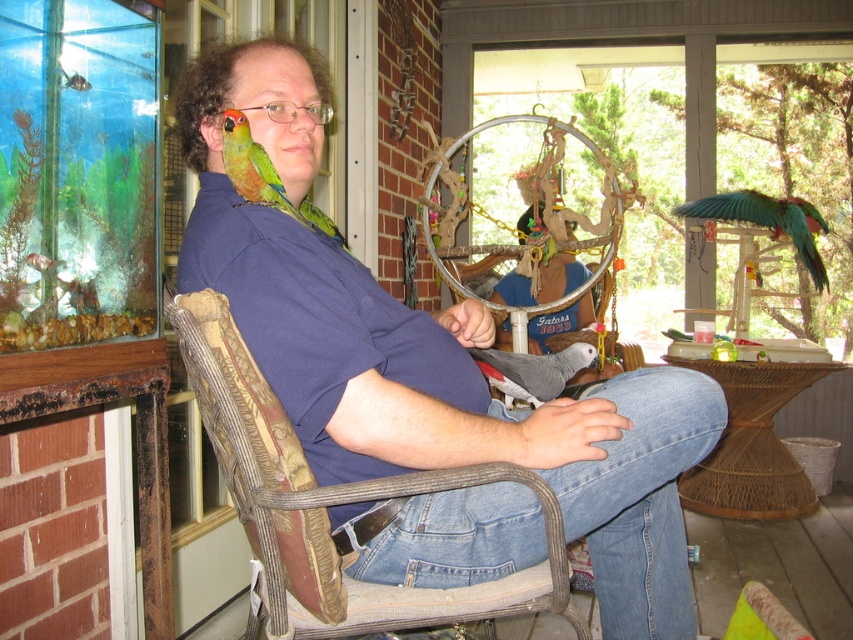
You are a bird enthusiast visiting this sunroom and want to place a new bird feeder between the green matte parrot at left and the gray matte parrot at lower center. The feeder requires at least 18 inches of space to be placed. Can you fit it between them?

The green matte parrot at left is 20.51 inches from the gray matte parrot at lower center, so yes, the feeder can be placed between them since the distance is more than the required 18 inches.

You are standing in front of the scene and want to know which of the two points, point (196, 371) or point (263, 188), is closer to you. Can you determine this based on their positions?

Point (196, 371) is closer to the camera than point (263, 188), so it is closer to you.